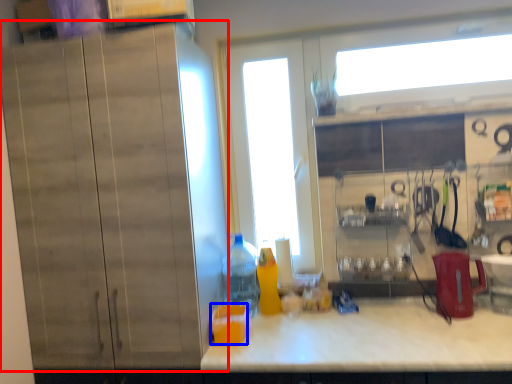
Question: Which of the following is the farthest to the observer, cabinetry (highlighted by a red box) or juice (highlighted by a blue box)?

Choices:
 (A) cabinetry
 (B) juice

Answer: (B)